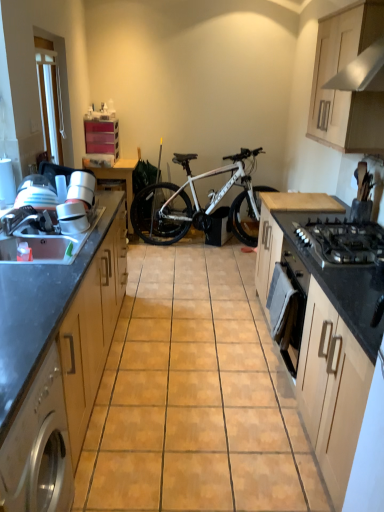
Question: Could you tell me if wooden cabinet at upper right, the third cabinetry viewed from the left, is facing white glossy exhaust hood at upper right?

Choices:
 (A) yes
 (B) no

Answer: (B)

Question: Considering the relative positions of wooden cabinet at upper right, the first cabinetry from the right, and white glossy exhaust hood at upper right in the image provided, is wooden cabinet at upper right, the first cabinetry from the right, to the left of white glossy exhaust hood at upper right from the viewer's perspective?

Choices:
 (A) no
 (B) yes

Answer: (A)

Question: Considering the relative sizes of wooden cabinet at upper right, the third cabinetry viewed from the left, and white glossy exhaust hood at upper right in the image provided, is wooden cabinet at upper right, the third cabinetry viewed from the left, smaller than white glossy exhaust hood at upper right?

Choices:
 (A) no
 (B) yes

Answer: (A)

Question: Can you confirm if wooden cabinet at upper right, the third cabinetry viewed from the left, is shorter than white glossy exhaust hood at upper right?

Choices:
 (A) yes
 (B) no

Answer: (B)

Question: Considering the relative sizes of wooden cabinet at upper right, the first cabinetry from the right, and white glossy exhaust hood at upper right in the image provided, is wooden cabinet at upper right, the first cabinetry from the right, wider than white glossy exhaust hood at upper right?

Choices:
 (A) yes
 (B) no

Answer: (B)

Question: Does point (57, 362) appear closer or farther from the camera than point (69, 216)?

Choices:
 (A) farther
 (B) closer

Answer: (B)

Question: From the image's perspective, is wooden cabinet at left, the 1th cabinetry from the left, positioned above or below white glossy blender at left?

Choices:
 (A) above
 (B) below

Answer: (B)

Question: Do you think wooden cabinet at left, the 1th cabinetry from the left, is within white glossy blender at left, or outside of it?

Choices:
 (A) inside
 (B) outside

Answer: (B)

Question: In terms of height, does wooden cabinet at left, the 3th cabinetry positioned from the right, look taller or shorter compared to white glossy blender at left?

Choices:
 (A) short
 (B) tall

Answer: (B)

Question: Is wooden cabinet at left, the 3th cabinetry positioned from the right, wider or thinner than white glossy exhaust hood at upper right?

Choices:
 (A) thin
 (B) wide

Answer: (B)

Question: Is wooden cabinet at left, the 1th cabinetry from the left, to the left or to the right of white glossy exhaust hood at upper right in the image?

Choices:
 (A) right
 (B) left

Answer: (B)

Question: From their relative heights in the image, would you say wooden cabinet at left, the 1th cabinetry from the left, is taller or shorter than white glossy exhaust hood at upper right?

Choices:
 (A) tall
 (B) short

Answer: (A)

Question: In the image, is wooden cabinet at left, the 3th cabinetry positioned from the right, positioned in front of or behind white glossy exhaust hood at upper right?

Choices:
 (A) behind
 (B) front

Answer: (B)

Question: Is point 364,74 closer or farther from the camera than point 71,209?

Choices:
 (A) farther
 (B) closer

Answer: (B)

Question: In terms of width, does white glossy exhaust hood at upper right look wider or thinner when compared to white glossy blender at left?

Choices:
 (A) wide
 (B) thin

Answer: (A)